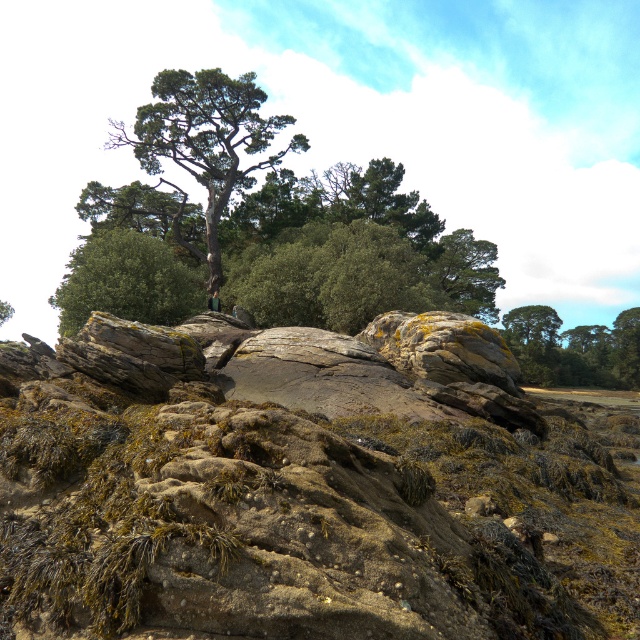
Question: Considering the relative positions of green rough bark tree at center and green matte tree at upper center in the image provided, where is green rough bark tree at center located with respect to green matte tree at upper center?

Choices:
 (A) right
 (B) left

Answer: (A)

Question: Based on their relative distances, which object is nearer to the green mossy rock at upper center?

Choices:
 (A) green matte tree at upper center
 (B) green rough bark tree at upper center
 (C) green leafy tree at center
 (D) mossy rock at center

Answer: (B)

Question: Is green rough bark tree at center in front of green rough bark tree at upper center?

Choices:
 (A) no
 (B) yes

Answer: (B)

Question: Does green rough bark tree at upper center appear under green matte tree at upper center?

Choices:
 (A) yes
 (B) no

Answer: (B)

Question: Which point is closer to the camera?

Choices:
 (A) (474, 307)
 (B) (604, 332)
 (C) (8, 307)

Answer: (A)

Question: Which point is closer to the camera taking this photo?

Choices:
 (A) (576, 346)
 (B) (474, 260)

Answer: (B)